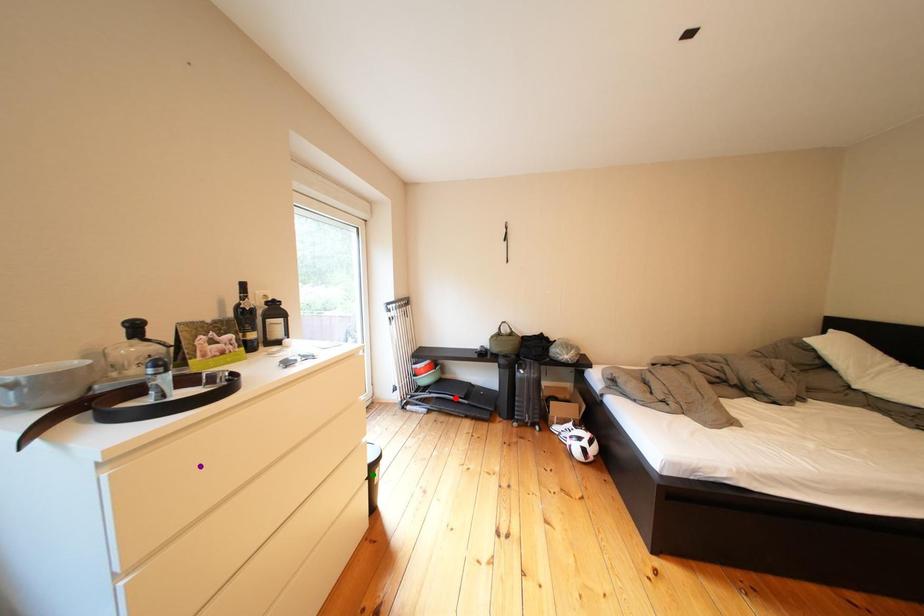
Order these from nearest to farthest:
purple point, red point, green point

purple point → green point → red point